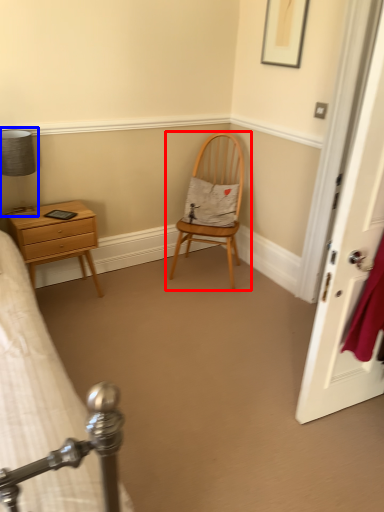
Question: Which object appears closest to the camera in this image, chair (highlighted by a red box) or bedside lamp (highlighted by a blue box)?

Choices:
 (A) chair
 (B) bedside lamp

Answer: (B)